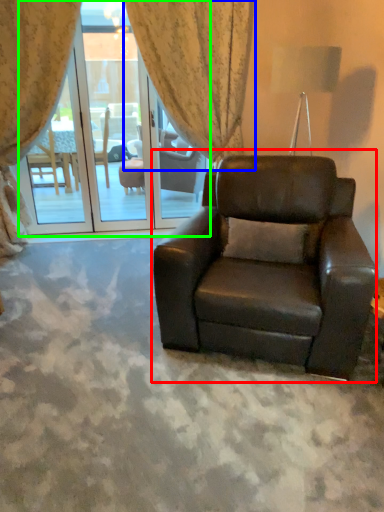
Question: Estimate the real-world distances between objects in this image. Which object is closer to chair (highlighted by a red box), curtain (highlighted by a blue box) or screen door (highlighted by a green box)?

Choices:
 (A) curtain
 (B) screen door

Answer: (A)